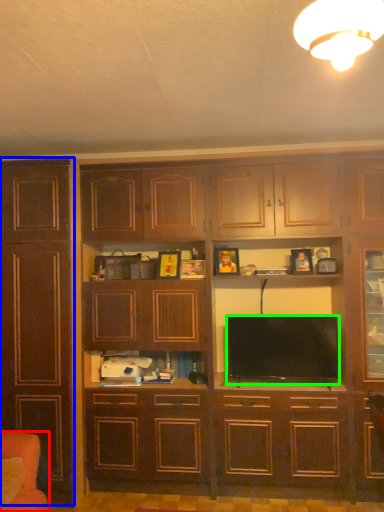
Question: Estimate the real-world distances between objects in this image. Which object is farther from armchair (highlighted by a red box), cabinetry (highlighted by a blue box) or television (highlighted by a green box)?

Choices:
 (A) cabinetry
 (B) television

Answer: (B)